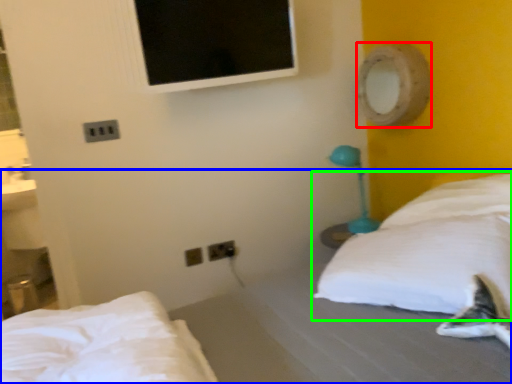
Question: Considering the real-world distances, which object is farthest from mirror (highlighted by a red box)? bed (highlighted by a blue box) or pillow (highlighted by a green box)?

Choices:
 (A) bed
 (B) pillow

Answer: (A)